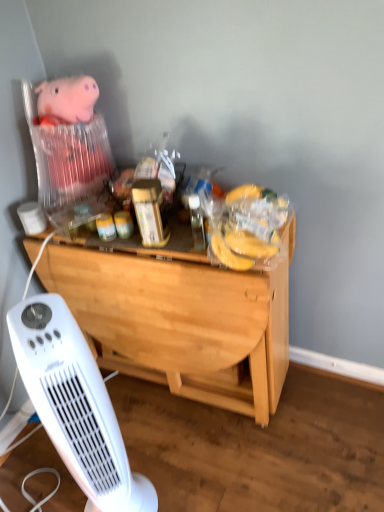
The height and width of the screenshot is (512, 384). Identify the location of empty space that is in between white plastic heater at lower left and light wood desk at center. (175, 446).